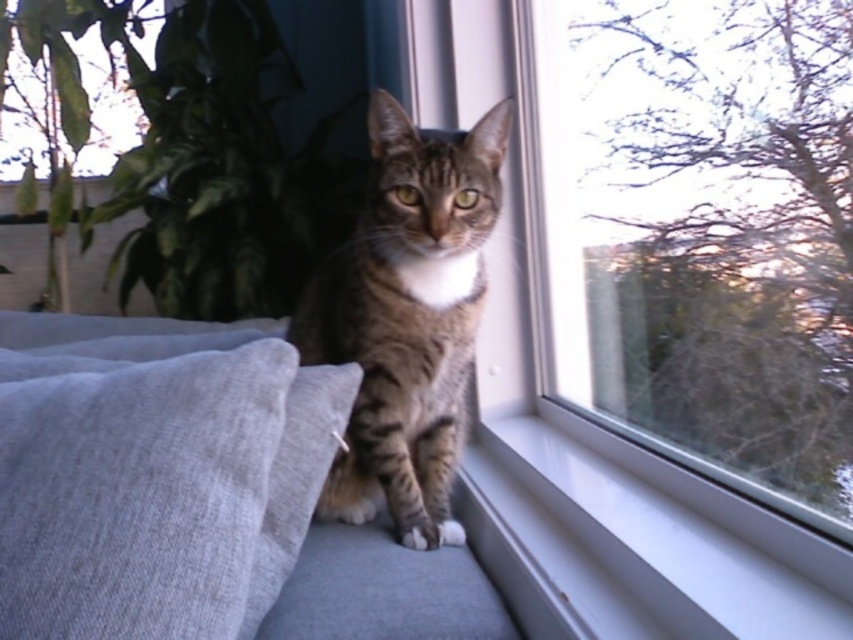
Is light gray fabric couch at center to the left of transparent glass window at center from the viewer's perspective?

Correct, you'll find light gray fabric couch at center to the left of transparent glass window at center.

Which of these two, light gray fabric couch at center or transparent glass window at center, stands shorter?

Standing shorter between the two is light gray fabric couch at center.

This screenshot has width=853, height=640. Identify the location of light gray fabric couch at center. (194, 493).

Is light gray fabric couch at center to the right of tabby fur cat at center from the viewer's perspective?

Incorrect, light gray fabric couch at center is not on the right side of tabby fur cat at center.

Who is lower down, light gray fabric couch at center or tabby fur cat at center?

light gray fabric couch at center is below.

Who is more distant from viewer, (24, 488) or (438, 413)?

The point (438, 413) is behind.

Where is `light gray fabric couch at center`? The width and height of the screenshot is (853, 640). light gray fabric couch at center is located at coordinates (194, 493).

Does point (706, 496) come behind point (479, 275)?

No, it is not.

Between transparent glass window at center and tabby fur cat at center, which one is positioned lower?

tabby fur cat at center

Where is `transparent glass window at center`? transparent glass window at center is located at coordinates (592, 429).

The width and height of the screenshot is (853, 640). What are the coordinates of `transparent glass window at center` in the screenshot? It's located at (592, 429).